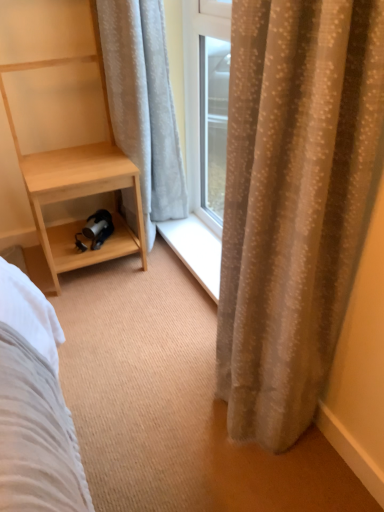
Find the location of `unoccupied space behind beige textured curtain at right, positioned as the 1th curtain in right-to-left order`. unoccupied space behind beige textured curtain at right, positioned as the 1th curtain in right-to-left order is located at coordinates (180, 315).